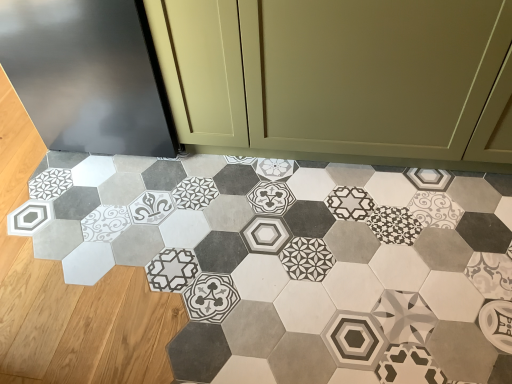
The height and width of the screenshot is (384, 512). I want to click on patterned hexagonal tile at center, so click(x=296, y=262).

Measure the distance between point (134, 199) and camera.

Point (134, 199) and camera are 1.72 meters apart.

What is the approximate width of patterned hexagonal tile at center?

patterned hexagonal tile at center is 3.50 feet wide.

What is the approximate height of patterned hexagonal tile at center?

The height of patterned hexagonal tile at center is 3.78 centimeters.

What do you see at coordinates (296, 262) in the screenshot? I see `patterned hexagonal tile at center` at bounding box center [296, 262].

What is the approximate width of matte olive green cabinet at center?

matte olive green cabinet at center is 25.77 inches wide.

What do you see at coordinates (338, 75) in the screenshot? I see `matte olive green cabinet at center` at bounding box center [338, 75].

Where is `matte olive green cabinet at center`? The width and height of the screenshot is (512, 384). matte olive green cabinet at center is located at coordinates (338, 75).

At what (x,y) coordinates should I click in order to perform the action: click on patterned hexagonal tile at center. Please return your answer as a coordinate pair (x, y). Looking at the image, I should click on (296, 262).

Considering the relative positions of matte olive green cabinet at center and patterned hexagonal tile at center in the image provided, is matte olive green cabinet at center to the right of patterned hexagonal tile at center from the viewer's perspective?

Yes, matte olive green cabinet at center is to the right of patterned hexagonal tile at center.

Is the position of matte olive green cabinet at center more distant than that of patterned hexagonal tile at center?

Yes.

Is point (250, 50) positioned before point (288, 370)?

No, it is not.

From the image's perspective, between matte olive green cabinet at center and patterned hexagonal tile at center, which one is located above?

matte olive green cabinet at center appears higher in the image.

From a real-world perspective, is matte olive green cabinet at center above or below patterned hexagonal tile at center?

From a real-world perspective, matte olive green cabinet at center is physically above patterned hexagonal tile at center.

Does matte olive green cabinet at center have a lesser width compared to patterned hexagonal tile at center?

Correct, the width of matte olive green cabinet at center is less than that of patterned hexagonal tile at center.

Considering the sizes of objects matte olive green cabinet at center and patterned hexagonal tile at center in the image provided, who is taller, matte olive green cabinet at center or patterned hexagonal tile at center?

matte olive green cabinet at center.

Considering the relative sizes of matte olive green cabinet at center and patterned hexagonal tile at center in the image provided, is matte olive green cabinet at center smaller than patterned hexagonal tile at center?

Actually, matte olive green cabinet at center might be larger than patterned hexagonal tile at center.

Do you think matte olive green cabinet at center is within patterned hexagonal tile at center, or outside of it?

matte olive green cabinet at center is located beyond the bounds of patterned hexagonal tile at center.

Is the surface of matte olive green cabinet at center in direct contact with patterned hexagonal tile at center?

No, matte olive green cabinet at center is not beside patterned hexagonal tile at center.

In the scene shown: Could you tell me if matte olive green cabinet at center is facing patterned hexagonal tile at center?

Yes, matte olive green cabinet at center faces towards patterned hexagonal tile at center.

Based on the photo, how different are the orientations of matte olive green cabinet at center and patterned hexagonal tile at center in degrees?

The facing directions of matte olive green cabinet at center and patterned hexagonal tile at center are 0.787 degrees apart.

Consider the image. Measure the distance between matte olive green cabinet at center and patterned hexagonal tile at center.

A distance of 17.16 inches exists between matte olive green cabinet at center and patterned hexagonal tile at center.

Locate an element on the screen. Image resolution: width=512 pixels, height=384 pixels. cabinetry above the patterned hexagonal tile at center (from the image's perspective) is located at coordinates (338, 75).

Can you confirm if patterned hexagonal tile at center is positioned to the right of matte olive green cabinet at center?

Incorrect, patterned hexagonal tile at center is not on the right side of matte olive green cabinet at center.

Considering the positions of objects patterned hexagonal tile at center and matte olive green cabinet at center in the image provided, who is behind, patterned hexagonal tile at center or matte olive green cabinet at center?

matte olive green cabinet at center is further from the camera.

Between point (234, 322) and point (332, 111), which one is positioned in front?

Point (234, 322)

From the image's perspective, between patterned hexagonal tile at center and matte olive green cabinet at center, which one is located above?

matte olive green cabinet at center appears higher in the image.

From a real-world perspective, is patterned hexagonal tile at center below matte olive green cabinet at center?

Indeed, from a real-world perspective, patterned hexagonal tile at center is positioned beneath matte olive green cabinet at center.

Which of these two, patterned hexagonal tile at center or matte olive green cabinet at center, is thinner?

Thinner between the two is matte olive green cabinet at center.

Can you confirm if patterned hexagonal tile at center is shorter than matte olive green cabinet at center?

Correct, patterned hexagonal tile at center is not as tall as matte olive green cabinet at center.

In the scene shown: Considering the sizes of objects patterned hexagonal tile at center and matte olive green cabinet at center in the image provided, who is smaller, patterned hexagonal tile at center or matte olive green cabinet at center?

Smaller between the two is patterned hexagonal tile at center.

Is patterned hexagonal tile at center inside the boundaries of matte olive green cabinet at center, or outside?

patterned hexagonal tile at center is not enclosed by matte olive green cabinet at center.

Is patterned hexagonal tile at center beside matte olive green cabinet at center?

No.

Is patterned hexagonal tile at center oriented away from matte olive green cabinet at center?

No, patterned hexagonal tile at center is not facing the opposite direction of matte olive green cabinet at center.

Can you tell me how much patterned hexagonal tile at center and matte olive green cabinet at center differ in facing direction?

They differ by 0.787 degrees in their facing directions.

The height and width of the screenshot is (384, 512). I want to click on cabinetry lying on the right of patterned hexagonal tile at center, so pos(338,75).

Find the location of a particular element. The height and width of the screenshot is (384, 512). porcelain on the left of matte olive green cabinet at center is located at coordinates (296, 262).

Identify the location of cabinetry lying on the right of patterned hexagonal tile at center. (338, 75).